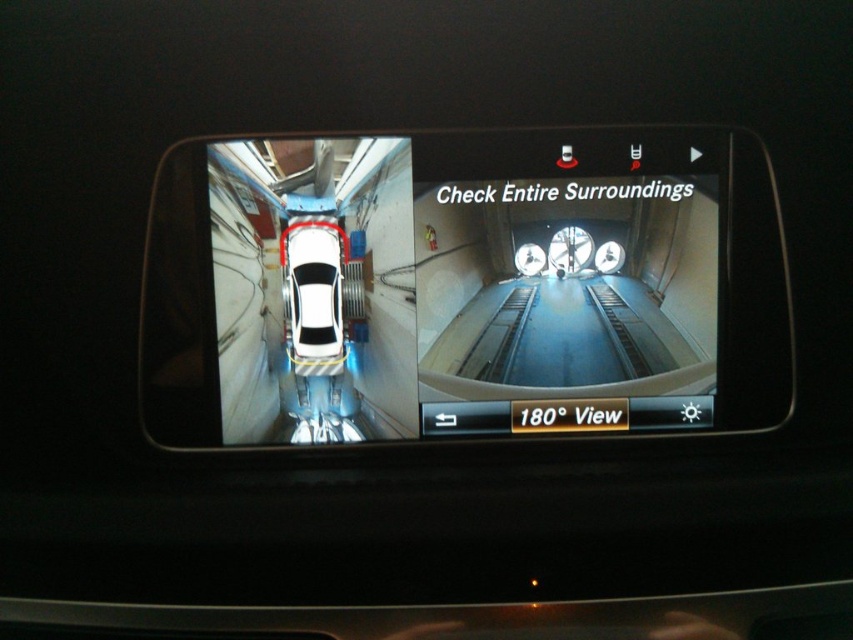
Who is lower down, transparent glass rearview mirror at center or white matte car at center?

white matte car at center is lower down.

Which is in front, point (177, 300) or point (309, 275)?

Point (177, 300) is more forward.

Where is `transparent glass rearview mirror at center`? This screenshot has height=640, width=853. transparent glass rearview mirror at center is located at coordinates (471, 285).